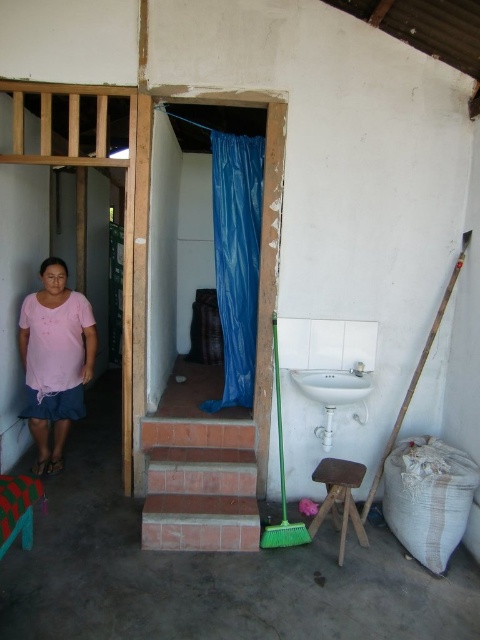
Question: Which object is closer to the camera taking this photo?

Choices:
 (A) pink fabric skirt at lower left
 (B) white glossy sink at center
 (C) blue plastic curtain at center

Answer: (B)

Question: Can you confirm if brown wooden stool at lower center is positioned to the left of white glossy sink at center?

Choices:
 (A) yes
 (B) no

Answer: (B)

Question: Is blue plastic curtain at center thinner than pink fabric skirt at lower left?

Choices:
 (A) yes
 (B) no

Answer: (A)

Question: Can you confirm if pink fabric skirt at lower left is positioned to the left of white glossy sink at center?

Choices:
 (A) no
 (B) yes

Answer: (B)

Question: Which point is closer to the camera?

Choices:
 (A) (159, 545)
 (B) (74, 340)

Answer: (A)

Question: Estimate the real-world distances between objects in this image. Which object is farther from the brick stairs at lower left?

Choices:
 (A) blue plastic curtain at center
 (B) pink fabric skirt at lower left
 (C) white glossy sink at center

Answer: (B)